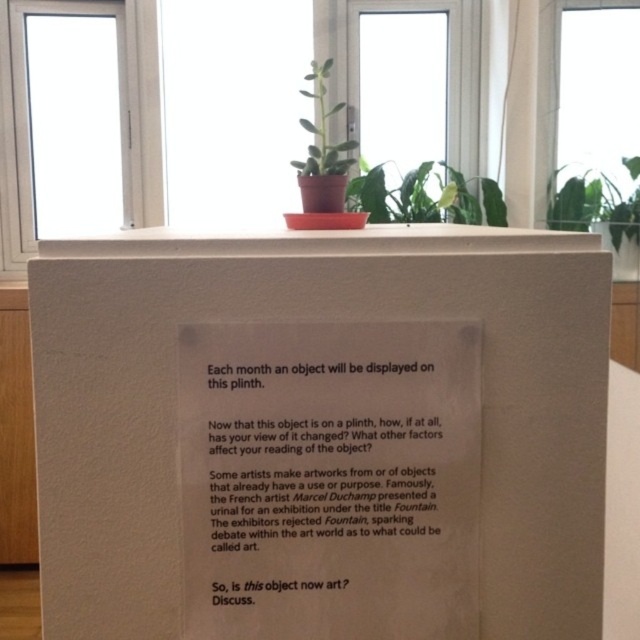
You are an art curator trying to determine the best way to arrange the green leafy plant at upper center and the green matte plant at upper center on the plinth. Since both plants are green, you want to ensure they are distinguishable from each other. Based on their sizes, which plant should you place in a position where its larger size will make it stand out more?

The green leafy plant at upper center has a larger width than the green matte plant at upper center, so placing the green leafy plant at upper center in a central or forward position on the plinth would make its larger size more noticeable and help distinguish it from the smaller green matte plant at upper center.

You are an art curator planning to hang a new poster that requires 1.2 square meters of space. You have two options in the current display setup. Which object, the white matte paper at center or the transparent glass window at upper center, would you choose to place the poster on?

The transparent glass window at upper center occupies more space than the white matte paper at center, so you should choose the transparent glass window at upper center to place the poster on since it can accommodate the required 1.2 square meters.